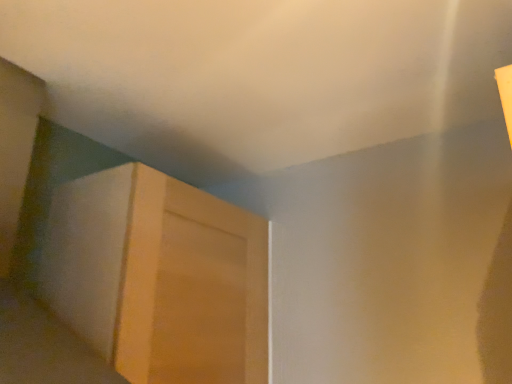
The width and height of the screenshot is (512, 384). What do you see at coordinates (191, 288) in the screenshot?
I see `matte wood screen door at center` at bounding box center [191, 288].

Where is `matte wood screen door at center`? Image resolution: width=512 pixels, height=384 pixels. matte wood screen door at center is located at coordinates (191, 288).

Locate an element on the screen. matte wood screen door at center is located at coordinates (191, 288).